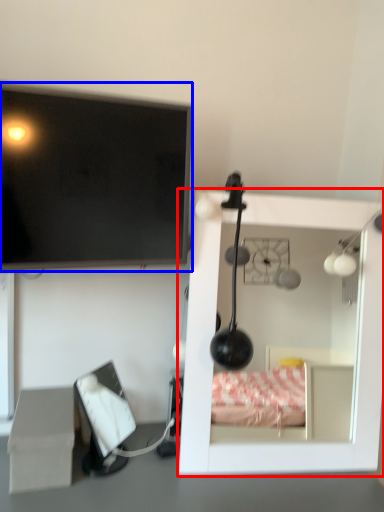
Question: Which object is closer to the camera taking this photo, furniture (highlighted by a red box) or television (highlighted by a blue box)?

Choices:
 (A) furniture
 (B) television

Answer: (B)